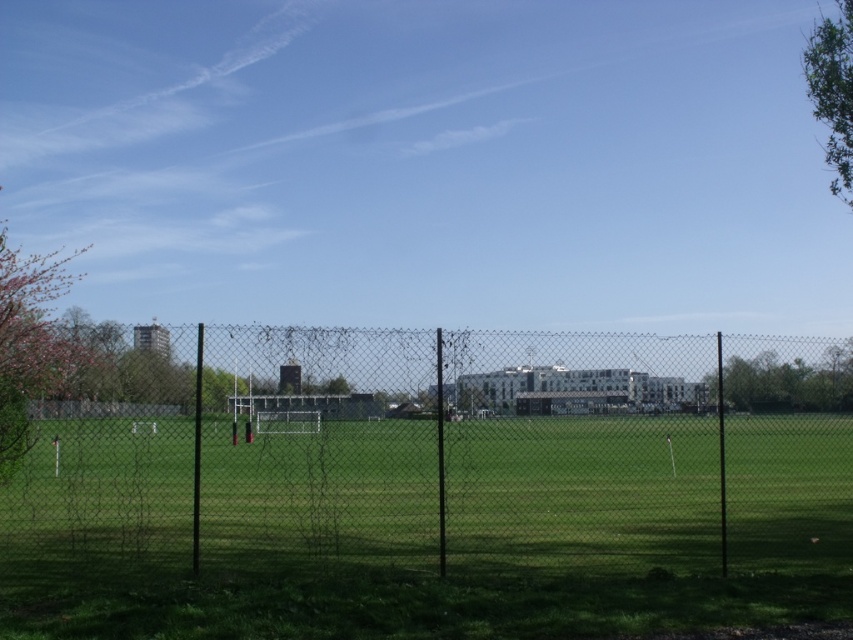
Can you confirm if pink blossoming tree at left is positioned below green leafy tree at right?

No, pink blossoming tree at left is not below green leafy tree at right.

Between point (27, 276) and point (724, 388), which one is positioned behind?

The point (27, 276) is behind.

Is point (19, 397) positioned after point (740, 371)?

Yes, it is.

Identify the location of pink blossoming tree at left. (30, 342).

Is point (665, 406) farther from camera compared to point (846, 60)?

No, (665, 406) is closer to viewer.

Does point (389, 371) come behind point (827, 160)?

No.

This screenshot has width=853, height=640. In order to click on metallic chain-link fence at center in this screenshot , I will do `click(451, 452)`.

Is metallic chain-link fence at center positioned in front of green leafy tree at right?

That is True.

Between point (200, 464) and point (810, 385), which one is positioned behind?

Point (810, 385)

Does point (801, 563) lie in front of point (846, 378)?

That is False.

The width and height of the screenshot is (853, 640). What are the coordinates of `metallic chain-link fence at center` in the screenshot? It's located at (451, 452).